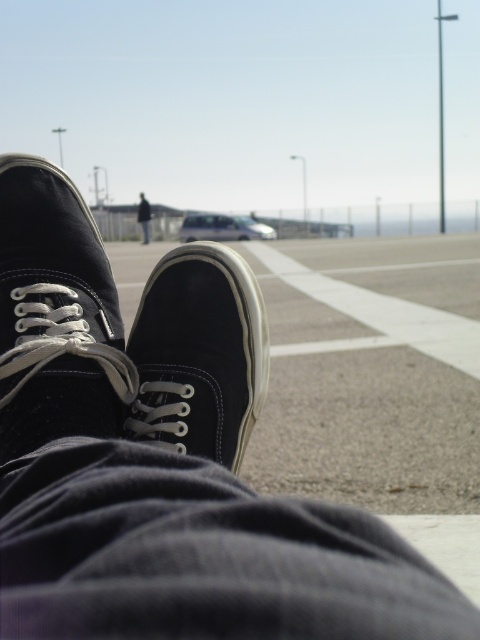
Question: Which of these objects is positioned closest to the dark blue jeans at center?

Choices:
 (A) matte black shoe at center
 (B) matte black shoe at lower left

Answer: (A)

Question: Can you confirm if matte black shoe at lower left is positioned to the right of dark blue jeans at center?

Choices:
 (A) yes
 (B) no

Answer: (A)

Question: Which point is closer to the camera?

Choices:
 (A) (180, 449)
 (B) (145, 236)

Answer: (A)

Question: Is matte black shoe at lower left smaller than matte black shoe at center?

Choices:
 (A) no
 (B) yes

Answer: (A)

Question: Which point is farther to the camera?

Choices:
 (A) dark blue jeans at center
 (B) matte black shoe at center
 (C) matte black shoe at lower left

Answer: (A)

Question: Is matte black shoe at center to the right of dark blue jeans at center from the viewer's perspective?

Choices:
 (A) yes
 (B) no

Answer: (A)